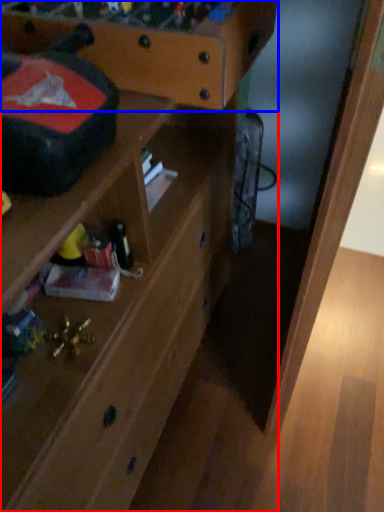
Question: Which object is further to the camera taking this photo, shelf (highlighted by a red box) or writing desk (highlighted by a blue box)?

Choices:
 (A) shelf
 (B) writing desk

Answer: (B)